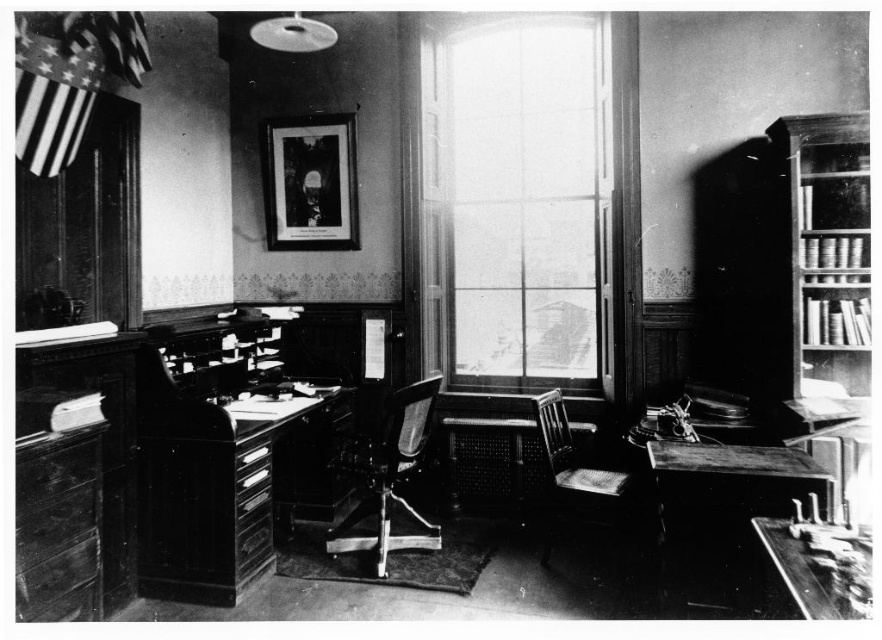
You are standing in the vintage office and need to locate the transparent glass window at center. According to the coordinates provided, where exactly is it positioned?

The transparent glass window at center is located at point (516, 200).

You are standing in the vintage office and want to determine which of the two points, point (498, 307) or point (736, 570), is closer to you. Based on the image, which point is nearer?

Point (498, 307) is further to the camera than point (736, 570), so the point closer to you is point (736, 570).

You are an interior designer planning to hang a large painting that requires a tall space. Based on the vintage office scene, which object between the transparent glass window at center and the wooden bookshelf at right would be more suitable for hanging the painting?

The transparent glass window at center is much taller than the wooden bookshelf at right, making it more suitable for hanging a large painting that requires a tall space.